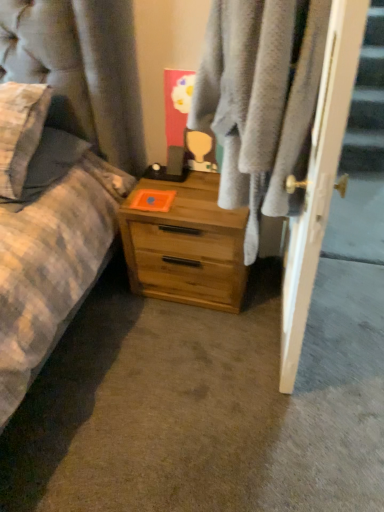
Find the location of a particular element. The width and height of the screenshot is (384, 512). soft gray towel at center is located at coordinates (261, 100).

Where is `white glossy door at right`? This screenshot has height=512, width=384. white glossy door at right is located at coordinates (319, 178).

Find the location of a particular element. The image size is (384, 512). soft gray towel at center is located at coordinates (261, 100).

Would you say white glossy door at right is part of soft gray towel at center's contents?

No, white glossy door at right is not a part of soft gray towel at center.

Between soft gray towel at center and white glossy door at right, which one has larger size?

With larger size is soft gray towel at center.

Looking at this image, is soft gray towel at center looking in the opposite direction of white glossy door at right?

No, soft gray towel at center is not facing the opposite direction of white glossy door at right.

Can we say soft gray towel at center lies outside light wood chest of drawers at center?

Indeed, soft gray towel at center is completely outside light wood chest of drawers at center.

Which is closer, (241, 147) or (209, 255)?

The point (241, 147) is more forward.

In the scene shown: Which of these two, soft gray towel at center or light wood chest of drawers at center, is smaller?

Smaller between the two is light wood chest of drawers at center.

Can you confirm if soft gray towel at center is positioned to the right of light wood chest of drawers at center?

Yes.

Is white glossy door at right not within light wood chest of drawers at center?

white glossy door at right is positioned outside light wood chest of drawers at center.

Is the depth of white glossy door at right less than that of light wood chest of drawers at center?

Yes, it is in front of light wood chest of drawers at center.

From the image's perspective, is white glossy door at right above or below light wood chest of drawers at center?

Clearly, from the image's perspective, white glossy door at right is above light wood chest of drawers at center.

Considering the positions of objects white glossy door at right and light wood chest of drawers at center in the image provided, who is more to the right, white glossy door at right or light wood chest of drawers at center?

From the viewer's perspective, white glossy door at right appears more on the right side.

Consider the image. Is white glossy door at right further to the viewer compared to soft gray towel at center?

Yes, it is.

Considering the sizes of objects white glossy door at right and soft gray towel at center in the image provided, who is wider, white glossy door at right or soft gray towel at center?

soft gray towel at center.

Is soft gray towel at center at the back of white glossy door at right?

No, white glossy door at right is not facing the opposite direction of soft gray towel at center.

Based on the photo, between white glossy door at right and soft gray towel at center, which one has smaller size?

Smaller between the two is white glossy door at right.

Which is nearer, (x=224, y=298) or (x=243, y=39)?

Point (x=224, y=298).

Is light wood chest of drawers at center aimed at soft gray towel at center?

No.

Consider the image. Considering their positions, is light wood chest of drawers at center located in front of or behind soft gray towel at center?

Clearly, light wood chest of drawers at center is behind soft gray towel at center.

Which object is wider, light wood chest of drawers at center or soft gray towel at center?

light wood chest of drawers at center is wider.

In terms of height, does light wood chest of drawers at center look taller or shorter compared to white glossy door at right?

In the image, light wood chest of drawers at center appears to be shorter than white glossy door at right.

Does light wood chest of drawers at center turn towards white glossy door at right?

No.

From the picture: Which is more to the right, light wood chest of drawers at center or white glossy door at right?

Positioned to the right is white glossy door at right.

Would you say light wood chest of drawers at center is inside or outside white glossy door at right?

The correct answer is: outside.

Image resolution: width=384 pixels, height=512 pixels. In order to click on door on the right of the soft gray towel at center in this screenshot , I will do `click(319, 178)`.

Find the location of `chest of drawers to the left of soft gray towel at center`. chest of drawers to the left of soft gray towel at center is located at coordinates (186, 245).

Looking at the image, which one is located closer to soft gray towel at center, white glossy door at right or light wood chest of drawers at center?

white glossy door at right.

From the image, which object appears to be nearer to soft gray towel at center, light wood chest of drawers at center or white glossy door at right?

white glossy door at right is closer to soft gray towel at center.

Consider the image. Estimate the real-world distances between objects in this image. Which object is further from white glossy door at right, soft gray towel at center or light wood chest of drawers at center?

The object further to white glossy door at right is light wood chest of drawers at center.

Estimate the real-world distances between objects in this image. Which object is further from white glossy door at right, light wood chest of drawers at center or soft gray towel at center?

The object further to white glossy door at right is light wood chest of drawers at center.

From the image, which object appears to be farther from light wood chest of drawers at center, soft gray towel at center or white glossy door at right?

Based on the image, white glossy door at right appears to be further to light wood chest of drawers at center.

Estimate the real-world distances between objects in this image. Which object is closer to light wood chest of drawers at center, white glossy door at right or soft gray towel at center?

soft gray towel at center is closer to light wood chest of drawers at center.

Where is `door positioned between soft gray towel at center and light wood chest of drawers at center from near to far`? The image size is (384, 512). door positioned between soft gray towel at center and light wood chest of drawers at center from near to far is located at coordinates (319, 178).